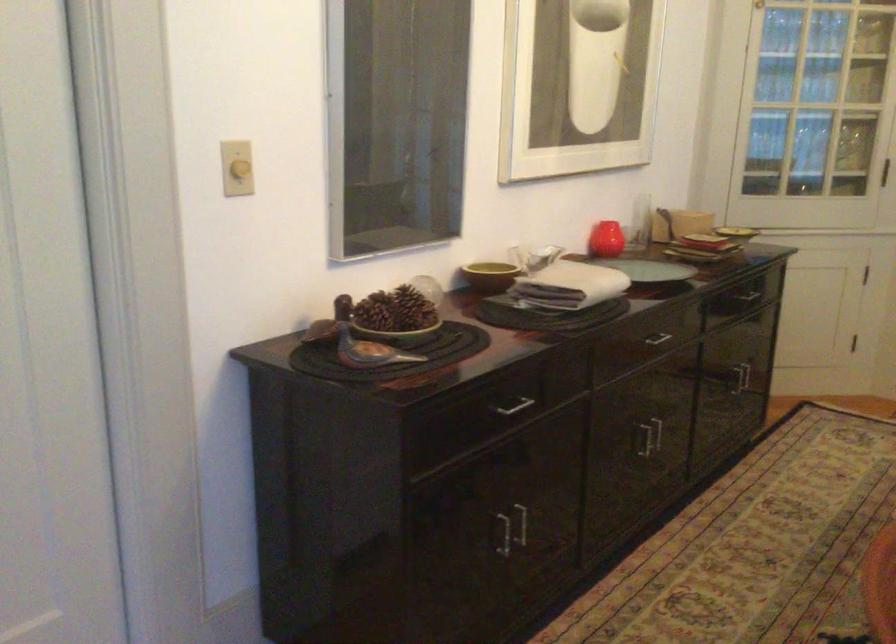
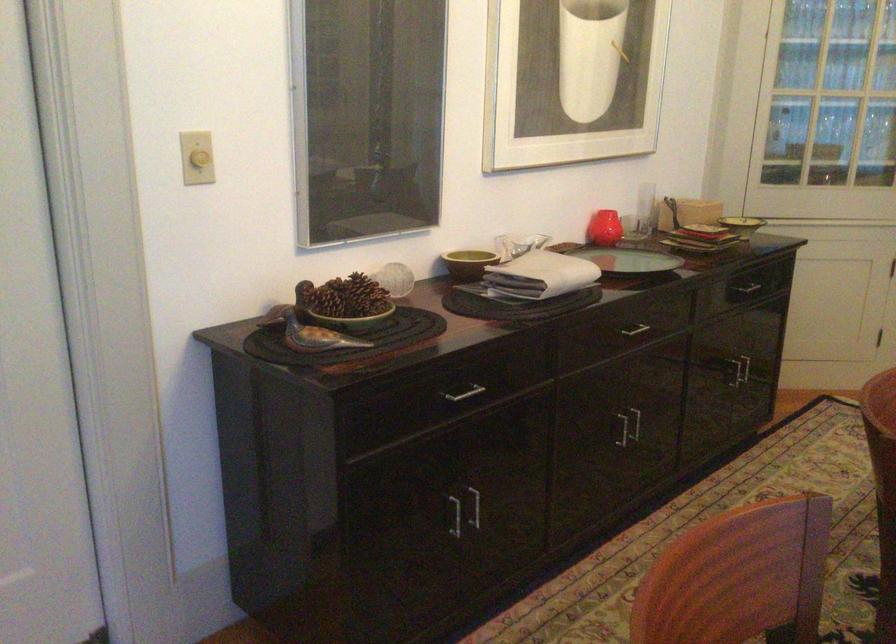
Locate, in the second image, the point that corresponds to [240,167] in the first image.

(200, 158)